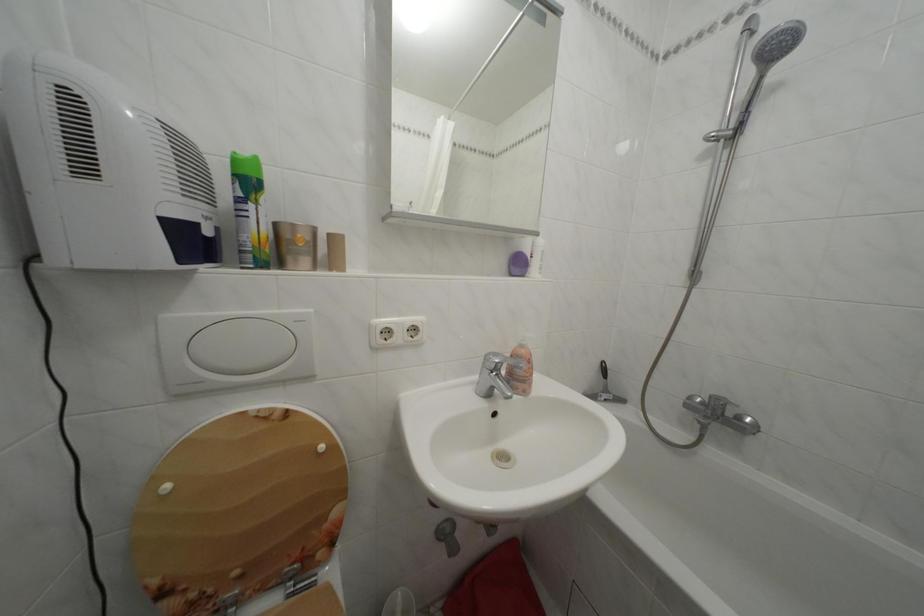
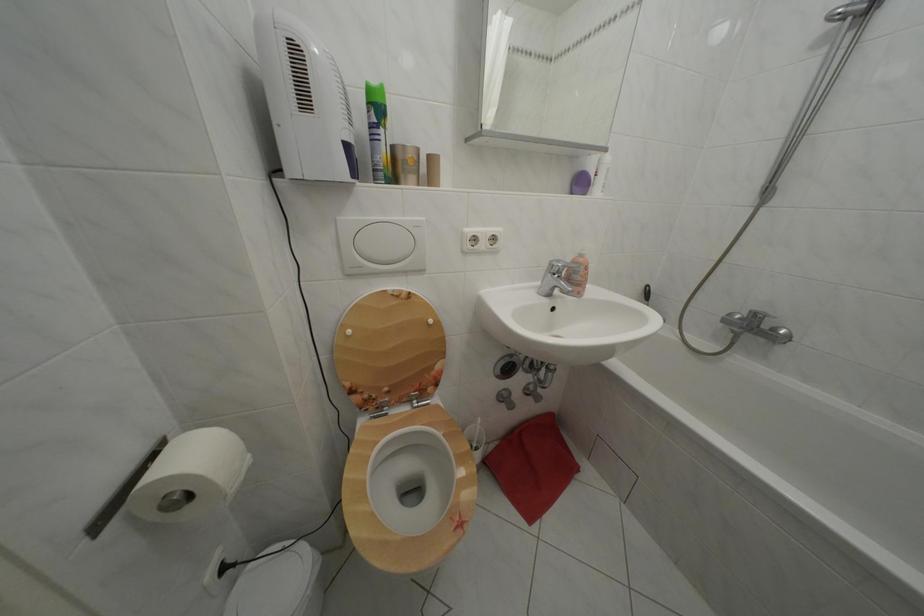
In the second image, find the point that corresponds to the point at 176,493 in the first image.

(358, 338)